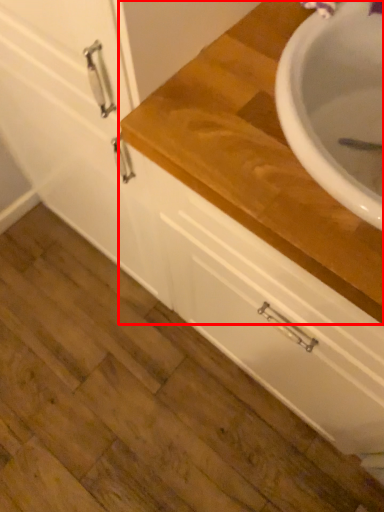
Question: From the image's perspective, where is countertop (annotated by the red box) located in relation to drawer in the image?

Choices:
 (A) below
 (B) above

Answer: (B)